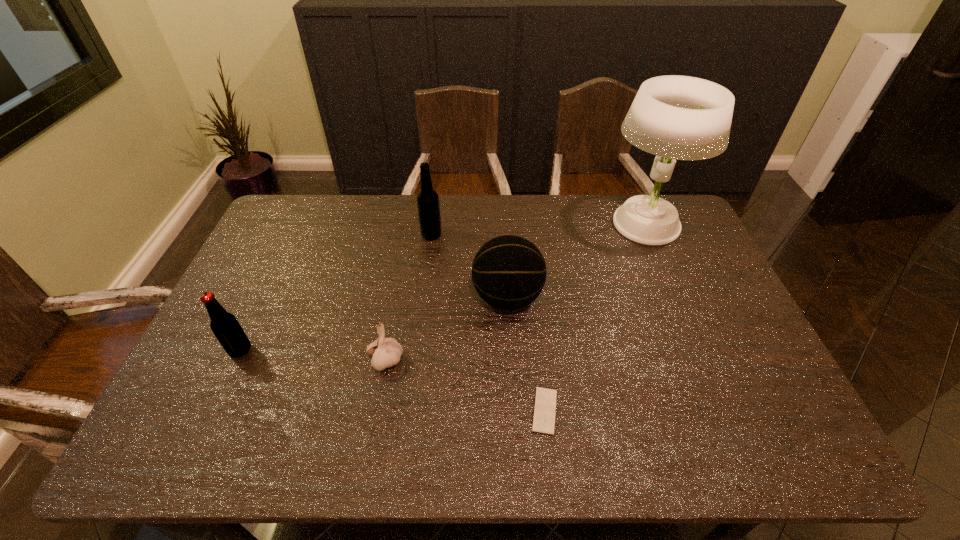
Locate an element on the screen. free space between the nearer beer bottle and the basketball is located at coordinates click(x=374, y=324).

Locate an element on the screen. free space between the shorter beer bottle and the garlic is located at coordinates (313, 356).

Locate an element on the screen. This screenshot has width=960, height=540. free space between the nearer beer bottle and the third farthest object is located at coordinates (374, 324).

Identify the location of vacant region between the tallest object and the basketball. The width and height of the screenshot is (960, 540). (576, 261).

At what (x,y) coordinates should I click in order to perform the action: click on free point between the second tallest object and the basketball. Please return your answer as a coordinate pair (x, y). The height and width of the screenshot is (540, 960). Looking at the image, I should click on (469, 266).

Identify the location of unoccupied position between the farther beer bottle and the shorter beer bottle. The height and width of the screenshot is (540, 960). (336, 293).

Where is `free area in between the second tallest object and the garlic`? free area in between the second tallest object and the garlic is located at coordinates pos(409,298).

At what (x,y) coordinates should I click in order to perform the action: click on unoccupied area between the garlic and the basketball. Please return your answer as a coordinate pair (x, y). The image size is (960, 540). Looking at the image, I should click on (446, 329).

Choose which object is the second nearest neighbor to the garlic. Please provide its 2D coordinates. Your answer should be formatted as a tuple, i.e. [(x, y)], where the tuple contains the x and y coordinates of a point satisfying the conditions above.

[(225, 326)]

This screenshot has height=540, width=960. Identify the location of the closest object to the shortest object. [509, 272].